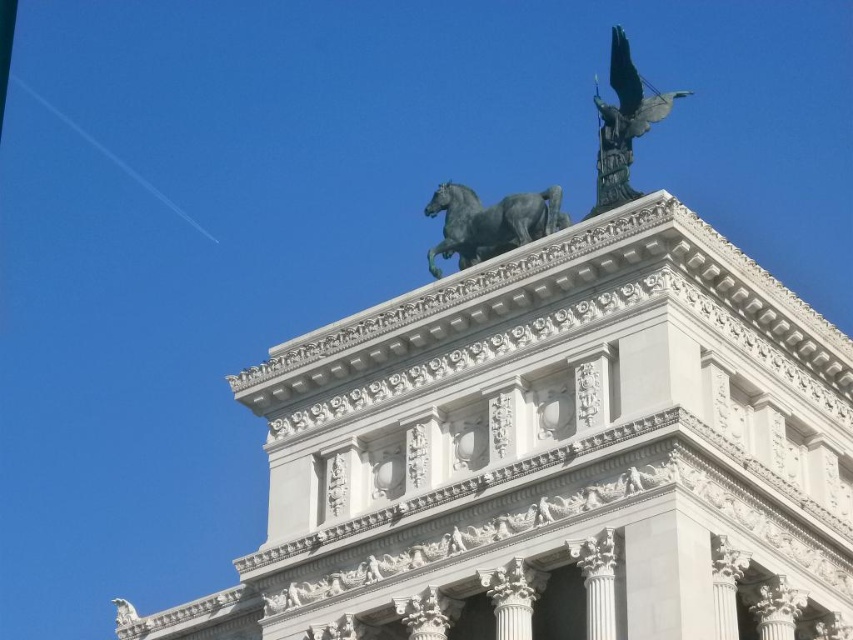
You are an art student analyzing the composition of the architectural structure. The shiny black horse at top center and green patina eagle at upper center are both part of the statue group. Which of these two elements is placed to the left of the other?

The shiny black horse at top center is positioned on the left side of green patina eagle at upper center.

You are an architect examining this classical structure. You notice the green polished stone tower at upper center and the shiny black horse at top center. Which object is positioned higher in the image?

The shiny black horse at top center is positioned higher than the green polished stone tower at upper center.

You are an art student analyzing the architectural sculpture. You notice the shiny black horse at top center and the green patina eagle at upper center. Which of these two sculptures is positioned closer to your viewpoint?

The shiny black horse at top center is positioned closer to the viewer than the green patina eagle at upper center according to the description.